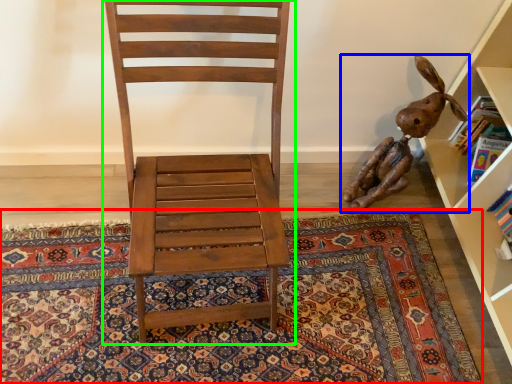
Question: Which object is positioned closest to mat (highlighted by a red box)? Select from toy (highlighted by a blue box) and chair (highlighted by a green box).

Choices:
 (A) toy
 (B) chair

Answer: (A)